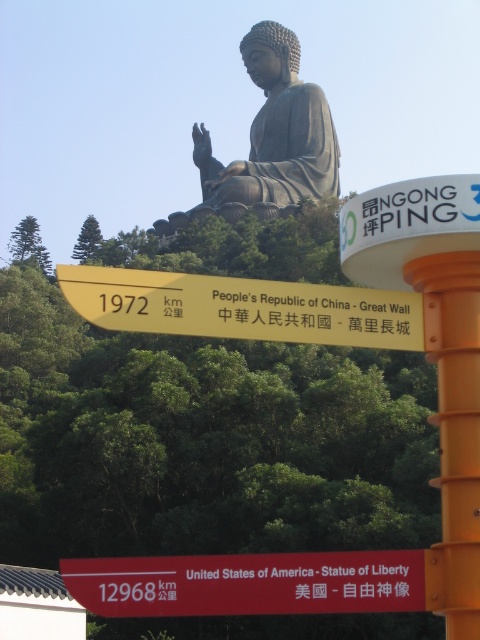
Question: Based on their relative distances, which object is nearer to the yellow metallic sign at upper center?

Choices:
 (A) bronze statue at upper center
 (B) red plastic sign at lower center

Answer: (B)

Question: Observing the image, what is the correct spatial positioning of red plastic sign at lower center in reference to bronze statue at upper center?

Choices:
 (A) above
 (B) below

Answer: (B)

Question: Which object is positioned farthest from the orange plastic pole at right?

Choices:
 (A) yellow metallic sign at upper center
 (B) red plastic sign at lower center
 (C) bronze statue at upper center

Answer: (C)

Question: Which object appears closest to the camera in this image?

Choices:
 (A) red plastic sign at lower center
 (B) yellow metallic sign at upper center

Answer: (B)

Question: Can you confirm if red plastic sign at lower center is positioned above orange plastic pole at right?

Choices:
 (A) yes
 (B) no

Answer: (B)

Question: Is yellow metallic sign at upper center wider than orange plastic pole at right?

Choices:
 (A) yes
 (B) no

Answer: (A)